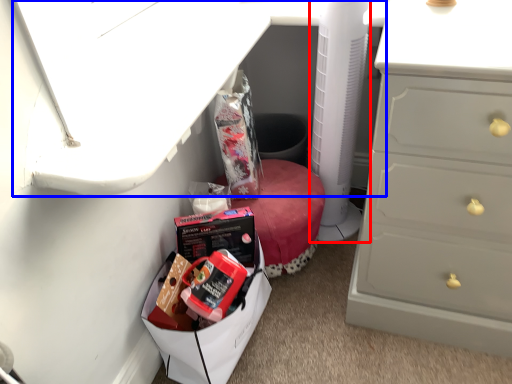
Question: Which point is further to the camera, appliance (highlighted by a red box) or vanity (highlighted by a blue box)?

Choices:
 (A) appliance
 (B) vanity

Answer: (A)